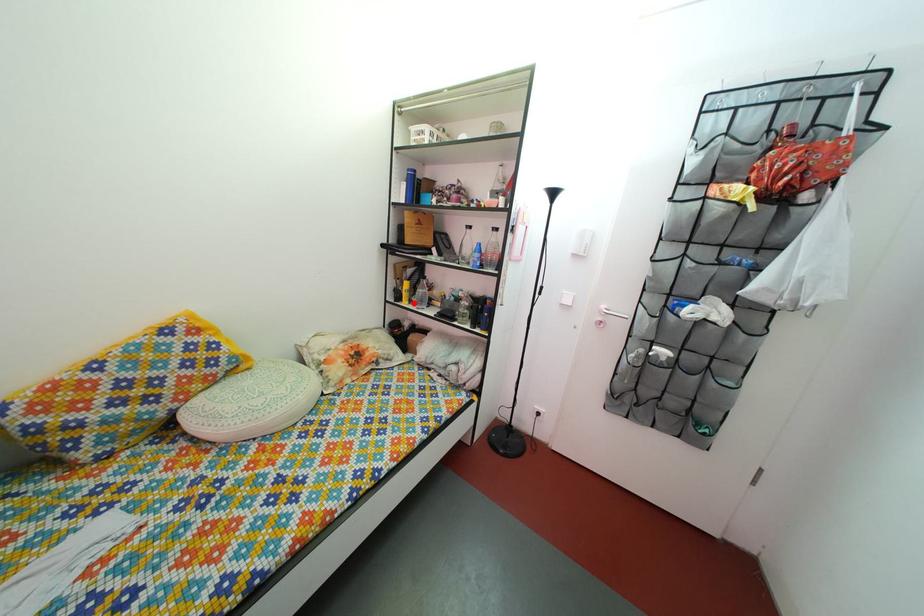
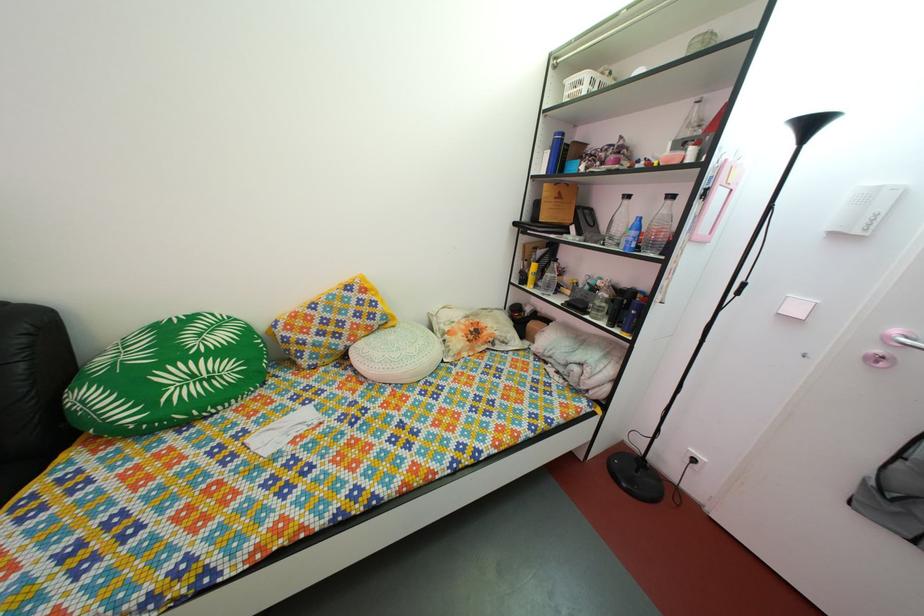
In the second image, find the point that corresponds to the highlighted location in the first image.

(540, 286)